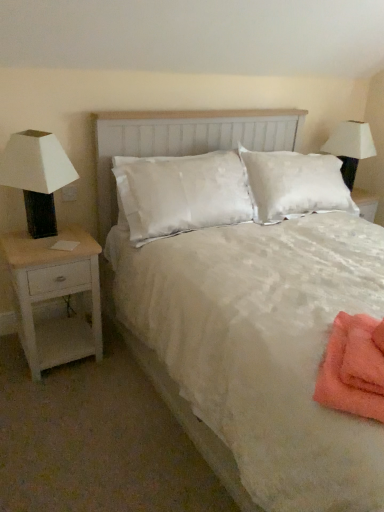
Question: Is white matte table lamp at left inside the boundaries of white fabric lampshade at upper right, or outside?

Choices:
 (A) outside
 (B) inside

Answer: (A)

Question: In terms of width, does white matte table lamp at left look wider or thinner when compared to white fabric lampshade at upper right?

Choices:
 (A) wide
 (B) thin

Answer: (B)

Question: Considering the real-world distances, which object is closest to the white satin bed at center?

Choices:
 (A) orange towel at lower right
 (B) white wood headboard at center
 (C) white matte table lamp at left
 (D) white wood nightstand at left
 (E) white fabric lampshade at upper right

Answer: (B)

Question: Which object is the closest to the white satin bed at center?

Choices:
 (A) white wood nightstand at left
 (B) orange towel at lower right
 (C) white fabric lampshade at upper right
 (D) white matte table lamp at left
 (E) white wood headboard at center

Answer: (E)